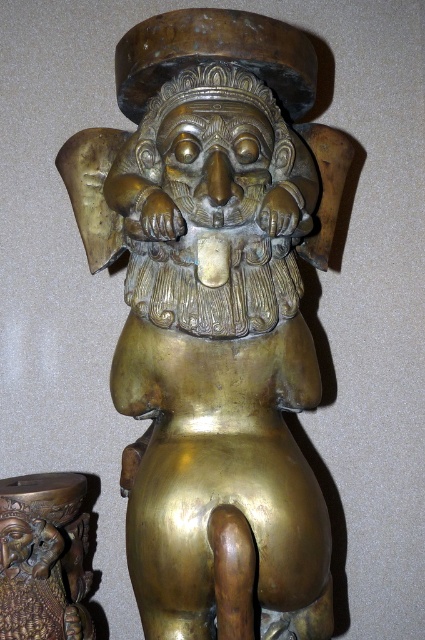
You are an art curator examining two statues in the center of the image. The shiny gold statue at center and the brass statue at center. Which one is positioned to the right?

The shiny gold statue at center is positioned to the right of the brass statue at center.

You are an art curator planning to display both the shiny gold statue at center and the brass statue at center in a gallery. Since space is limited, you need to know which statue requires more space. Which statue should be placed in a larger area?

The shiny gold statue at center is bigger than the brass statue at center, so it requires more space and should be placed in a larger area.

You are an art conservator working in a museum. You need to place both the shiny gold statue at center and the brass statue at center on a display shelf that is 30 centimeters wide. Can both statues fit side by side on the shelf without overlapping?

The shiny gold statue at center and brass statue at center are 25.31 centimeters apart from each other. Since the shelf is 30 centimeters wide, there is enough space to place both statues side by side without overlapping, as 25.31 cm is less than 30 cm.